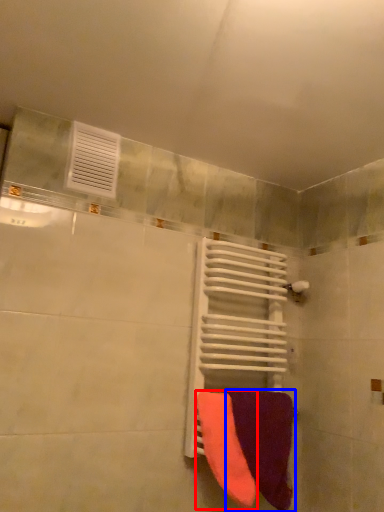
Question: Which object is further to the camera taking this photo, towel (highlighted by a red box) or towel (highlighted by a blue box)?

Choices:
 (A) towel
 (B) towel

Answer: (B)